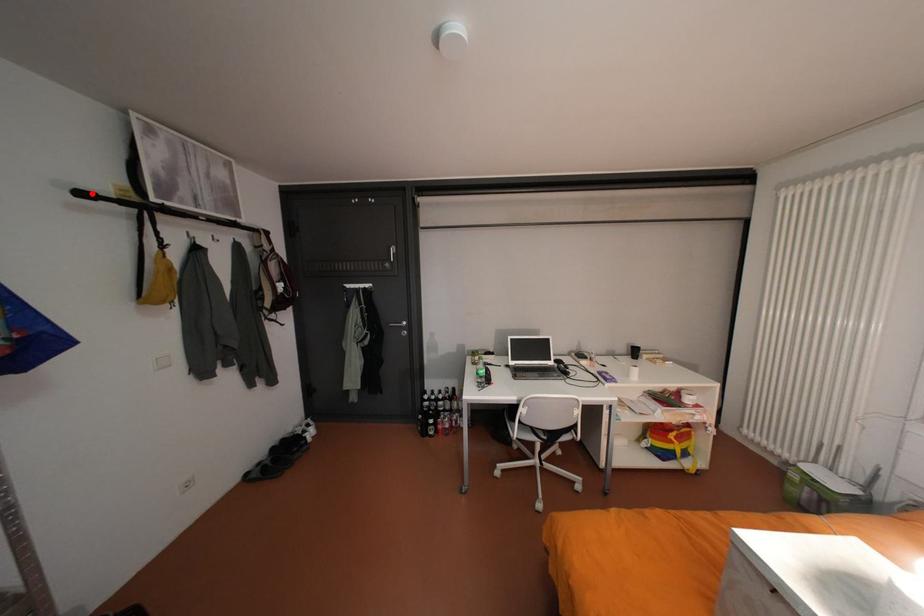
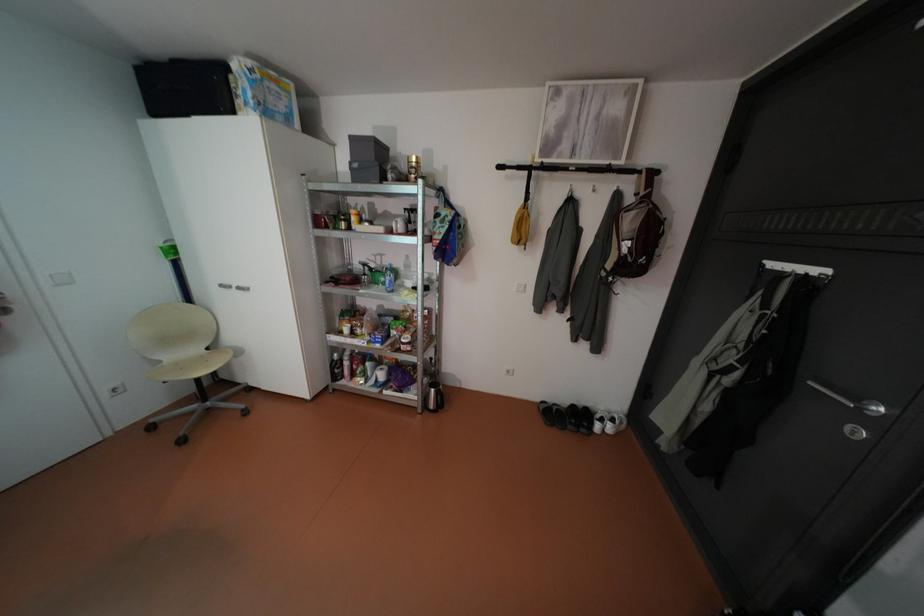
Find the pixel in the second image that matches the highlighted location in the first image.

(508, 166)